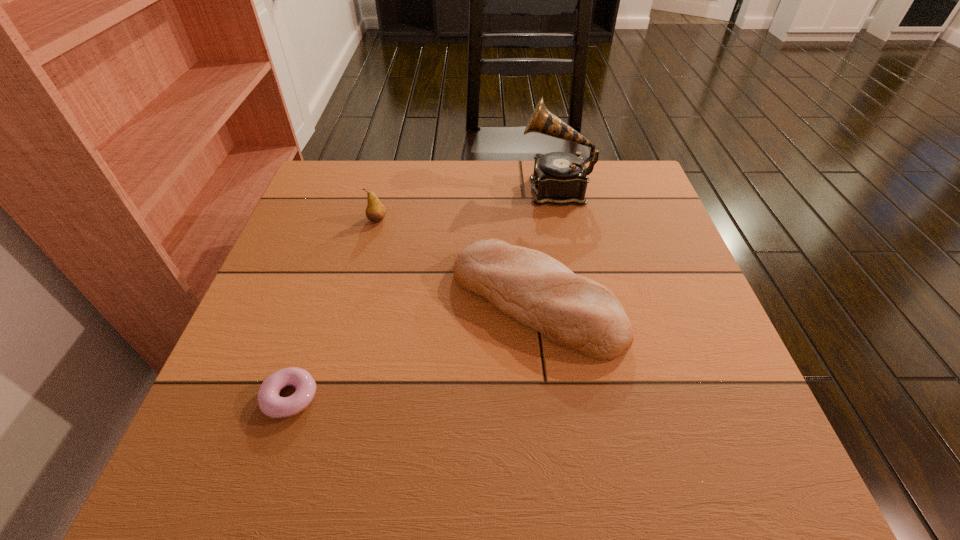
Locate an element on the screen. the tallest object is located at coordinates (560, 178).

Find the location of a particular element. The image size is (960, 540). phonograph record is located at coordinates (560, 178).

The height and width of the screenshot is (540, 960). In order to click on the second farthest object in this screenshot , I will do `click(375, 212)`.

Locate an element on the screen. Image resolution: width=960 pixels, height=540 pixels. the third farthest object is located at coordinates (572, 311).

Identify the location of doughnut. The width and height of the screenshot is (960, 540). (270, 403).

Locate an element on the screen. The width and height of the screenshot is (960, 540). the nearest object is located at coordinates coord(270,403).

Where is `vacant space situated 0.290m on the horn of the phonograph record`? Image resolution: width=960 pixels, height=540 pixels. vacant space situated 0.290m on the horn of the phonograph record is located at coordinates (415, 190).

The height and width of the screenshot is (540, 960). I want to click on vacant space situated 0.180m on the horn of the phonograph record, so click(454, 190).

You are a GUI agent. You are given a task and a screenshot of the screen. Output one action in this format:
    pyautogui.click(x=<x>, y=<y>)
    Task: Click on the vacant position located 0.300m on the horn of the phonograph record
    
    Given the screenshot: What is the action you would take?
    pyautogui.click(x=411, y=190)

Locate an element on the screen. The image size is (960, 540). vacant position located 0.370m on the front of the pear is located at coordinates (344, 349).